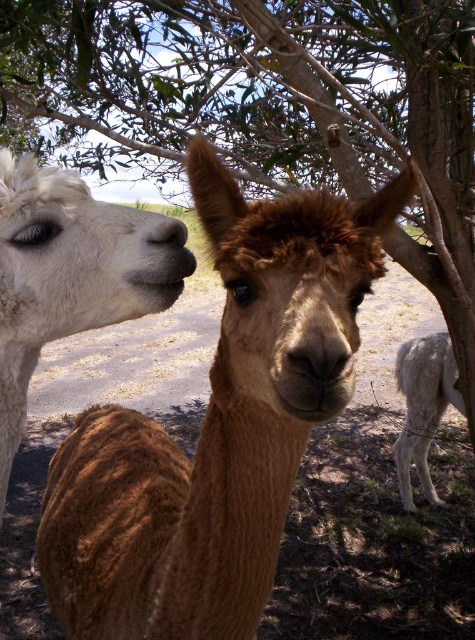
From the picture: Who is more forward, (436, 493) or (178, 228)?

Point (178, 228) is more forward.

Is white woolen camel at lower right thinner than matte black nose at center?

In fact, white woolen camel at lower right might be wider than matte black nose at center.

Identify the location of white woolen camel at lower right. The image size is (475, 640). (423, 406).

The image size is (475, 640). Identify the location of white woolen camel at lower right. (423, 406).

Is white woolly alpaca at left shorter than matte black nose at center?

Incorrect, white woolly alpaca at left's height does not fall short of matte black nose at center's.

Is point (93, 298) positioned before point (149, 237)?

Yes, it is in front of point (149, 237).

What do you see at coordinates (67, 275) in the screenshot? The height and width of the screenshot is (640, 475). I see `white woolly alpaca at left` at bounding box center [67, 275].

Where is `white woolly alpaca at left`? The height and width of the screenshot is (640, 475). white woolly alpaca at left is located at coordinates (67, 275).

Looking at this image, between white woolly alpaca at left and white woolen camel at lower right, which one is positioned lower?

white woolen camel at lower right is below.

Describe the element at coordinates (67, 275) in the screenshot. I see `white woolly alpaca at left` at that location.

Identify the location of white woolly alpaca at left. (67, 275).